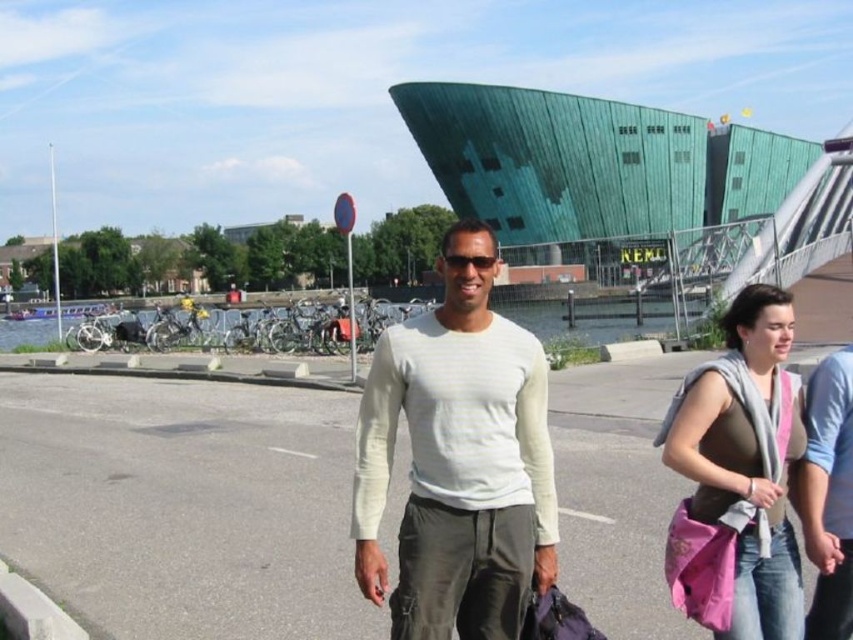
Based on the scene description, what object is located at the coordinates point [630,189]?

The green glass pedestrian bridge at upper center is located at point [630,189].

You are a photographer standing in the urban scene. You want to take a photo that includes both the white cotton shirt at center and the pink fabric bag at lower right. Which object should you adjust your camera angle to focus on first to ensure both are in frame?

The white cotton shirt at center is below the pink fabric bag at lower right, so you should focus on the pink fabric bag at lower right first to ensure both are in frame.

Based on the scene description, what are the coordinates of the green glass pedestrian bridge at upper center?

The green glass pedestrian bridge at upper center is located at coordinates (630, 189).